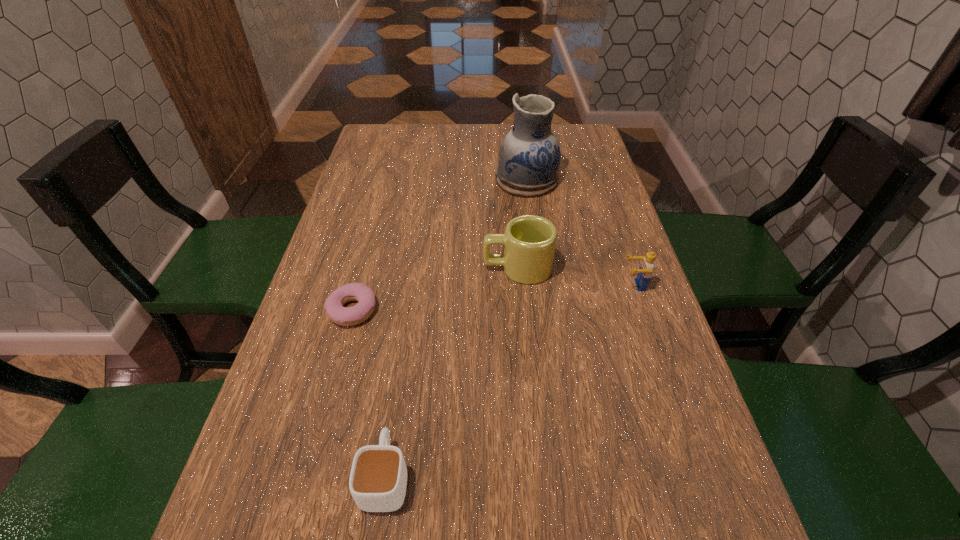
Locate an element on the screen. The height and width of the screenshot is (540, 960). free point located 0.060m with the handle on the side of the mug is located at coordinates (458, 268).

In order to click on vacant region located 0.220m with the handle on the side of the mug in this screenshot , I will do `click(390, 268)`.

Where is `vacant region located with the handle on the side of the mug`? vacant region located with the handle on the side of the mug is located at coordinates (416, 268).

Where is `free spot located on the face of the third tallest object`? free spot located on the face of the third tallest object is located at coordinates (499, 285).

At what (x,y) coordinates should I click in order to perform the action: click on vacant space located 0.230m on the face of the third tallest object. Please return your answer as a coordinate pair (x, y). The image size is (960, 540). Looking at the image, I should click on (521, 285).

Locate an element on the screen. vacant space located 0.190m on the face of the third tallest object is located at coordinates (540, 285).

Locate an element on the screen. free space located 0.260m on the side with the handle of the cup is located at coordinates (408, 322).

Find the location of a particular element. The image size is (960, 540). vacant space located 0.200m on the side with the handle of the cup is located at coordinates (405, 345).

Where is `vacant point located 0.340m on the side with the handle of the cup`? The width and height of the screenshot is (960, 540). vacant point located 0.340m on the side with the handle of the cup is located at coordinates (412, 294).

At what (x,y) coordinates should I click in order to perform the action: click on vacant space located 0.250m on the right of the doughnut. Please return your answer as a coordinate pair (x, y). The image size is (960, 540). Looking at the image, I should click on (492, 310).